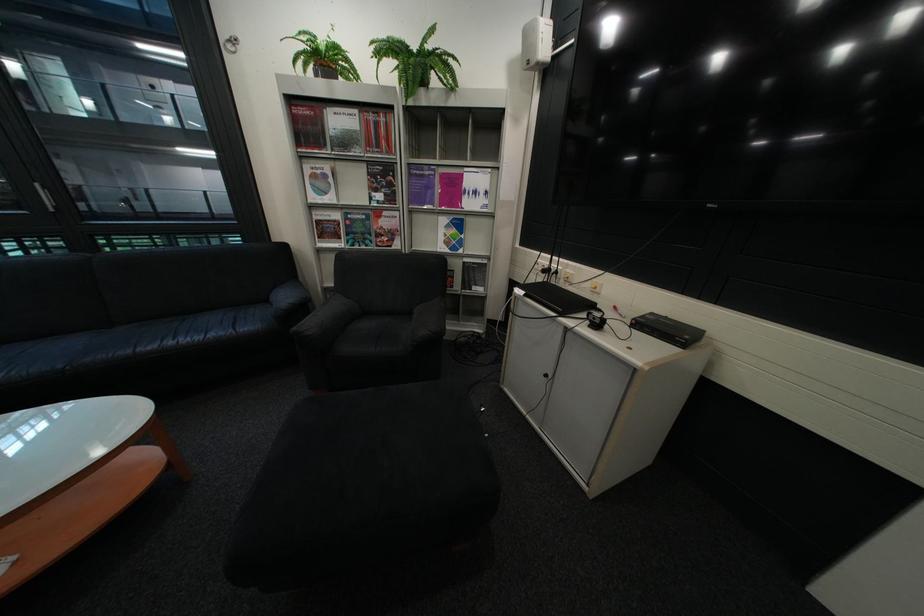
Find where to lift the red book. Please return your answer as a coordinate pair (x, y).

(308, 126)